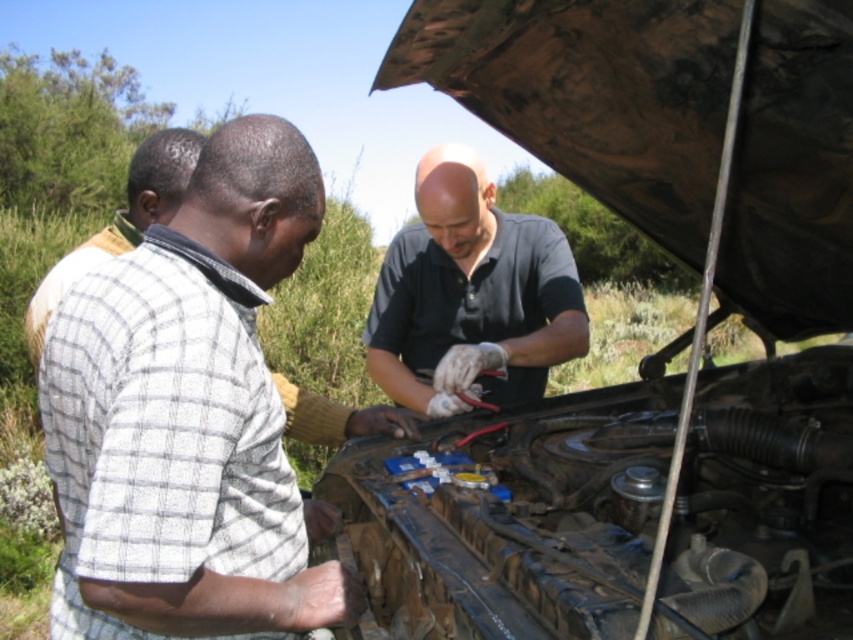
You are a photographer trying to capture a group photo of the three men working on the vehicle. Since you want to ensure both the white checkered shirt at center and the dark gray shirt at center are clearly visible in the frame, which shirt should you focus on to ensure both are in focus?

The white checkered shirt at center is bigger than the dark gray shirt at center, so focusing on the larger white checkered shirt at center will help ensure both are in focus as it occupies more space in the frame.

You are observing three men working on a vehicle engine. You notice two men wearing white checkered shirts. Which man is shorter between the white checkered shirt at center and the white checkered shirt at left?

The white checkered shirt at center is shorter than the white checkered shirt at left.